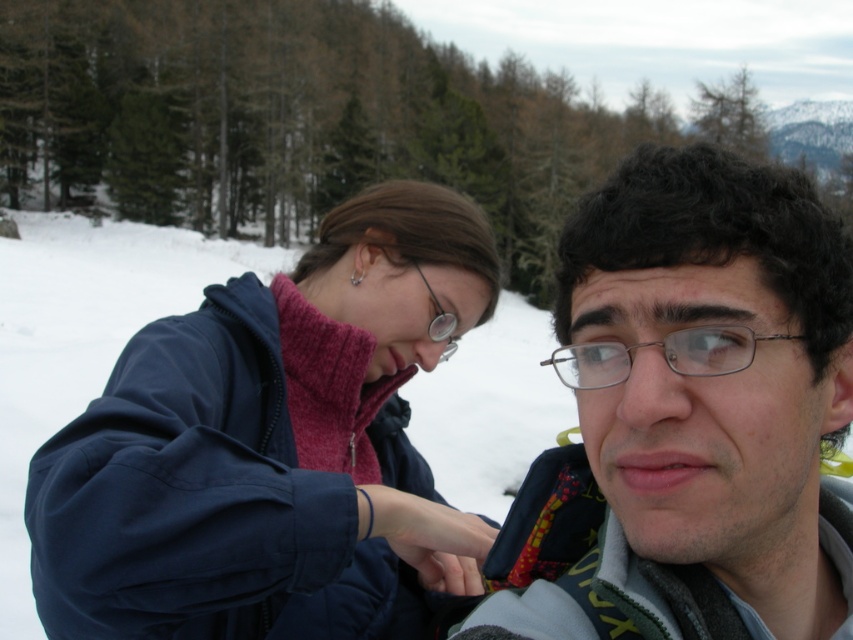
Question: Which point is farther from the camera taking this photo?

Choices:
 (A) (643, 196)
 (B) (718, 332)

Answer: (A)

Question: Among these points, which one is nearest to the camera?

Choices:
 (A) (440, 355)
 (B) (670, 504)
 (C) (291, 532)

Answer: (B)

Question: Estimate the real-world distances between objects in this image. Which object is farther from the matte blue jacket at center-left?

Choices:
 (A) metallic silver glasses at center
 (B) matte black glasses at center
 (C) matte metal glasses at upper center

Answer: (A)

Question: Is metallic silver glasses at center positioned before matte metal glasses at upper center?

Choices:
 (A) yes
 (B) no

Answer: (A)

Question: Does metallic silver glasses at center come in front of matte metal glasses at upper center?

Choices:
 (A) no
 (B) yes

Answer: (B)

Question: Can you confirm if matte blue jacket at center-left is bigger than matte metal glasses at upper center?

Choices:
 (A) no
 (B) yes

Answer: (B)